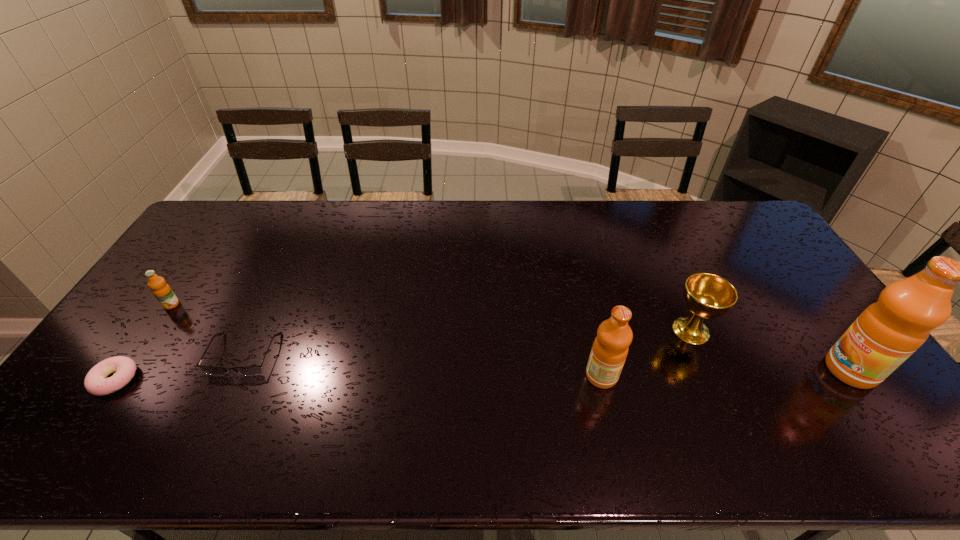
Identify the location of the third object from right to left. Image resolution: width=960 pixels, height=540 pixels. (610, 348).

Identify the location of the shorter fruit juice. (610, 348).

Identify the location of the taller fruit juice. (887, 332).

You are a GUI agent. You are given a task and a screenshot of the screen. Output one action in this format:
    pyautogui.click(x=<x>, y=<y>)
    Task: Click on the rightmost object
    
    Given the screenshot: What is the action you would take?
    pyautogui.click(x=887, y=332)

Find the location of a particular element. orange juice is located at coordinates (161, 290).

You are a GUI agent. You are given a task and a screenshot of the screen. Output one action in this format:
    pyautogui.click(x=<x>, y=<y>)
    Task: Click on the farthest object
    The image size is (960, 540).
    Given the screenshot: What is the action you would take?
    pyautogui.click(x=161, y=290)

Identify the location of the fourth object from right to left. This screenshot has height=540, width=960. (248, 370).

Locate an element on the screen. This screenshot has height=540, width=960. the fifth object from left to right is located at coordinates (706, 295).

The height and width of the screenshot is (540, 960). I want to click on the third tallest object, so [x=706, y=295].

Image resolution: width=960 pixels, height=540 pixels. Identify the location of doughnut. (96, 383).